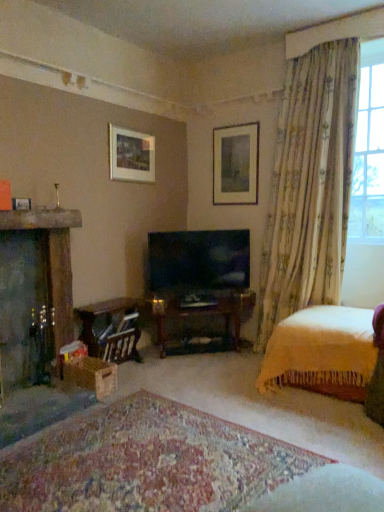
Question: Considering the positions of yellow knitted blanket at lower right and matte white picture frame at upper center, arranged as the third picture frame when viewed from the left, in the image, is yellow knitted blanket at lower right wider or thinner than matte white picture frame at upper center, arranged as the third picture frame when viewed from the left,?

Choices:
 (A) thin
 (B) wide

Answer: (B)

Question: From the image's perspective, is yellow knitted blanket at lower right above or below matte white picture frame at upper center, the third picture frame when ordered from front to back?

Choices:
 (A) below
 (B) above

Answer: (A)

Question: Which object is the farthest from the carpeted rug at center?

Choices:
 (A) matte white picture frame at upper center, arranged as the third picture frame when viewed from the left
 (B) dark gray stone fireplace at left
 (C) matte black tv at center
 (D) matte white picture frame at upper left, the 3th picture frame positioned from the back
 (E) translucent floral curtains at right

Answer: (A)

Question: Based on their relative distances, which object is farther from the matte white picture frame at upper left, the 3th picture frame positioned from the back?

Choices:
 (A) translucent floral curtains at right
 (B) wooden table at lower left
 (C) matte white picture frame at upper center, arranged as the third picture frame when viewed from the left
 (D) carpeted rug at center
 (E) floral fabric curtain at upper right

Answer: (A)